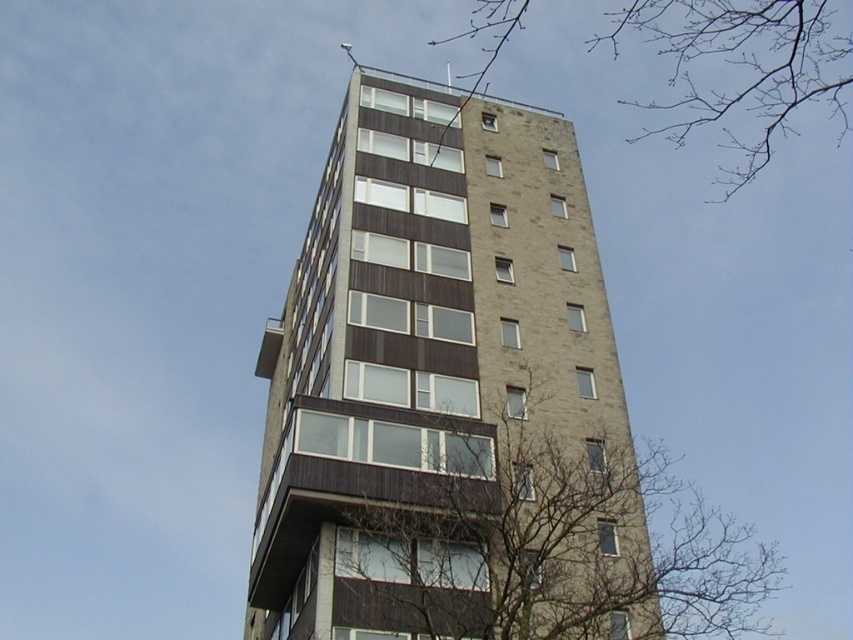
You are an architect analyzing the building facade. Based on the image, which object has a narrower width between the brown brick building at center and the bare branches at upper center?

The brown brick building at center has a lesser width compared to the bare branches at upper center, so the brown brick building at center is narrower in width.

You are standing in front of the residential building and notice two sets of branches in the image. Which set of branches, the brown leafless branches at lower center or the bare branches at upper center, is located to the left of the other?

The brown leafless branches at lower center is positioned on the left side of bare branches at upper center.